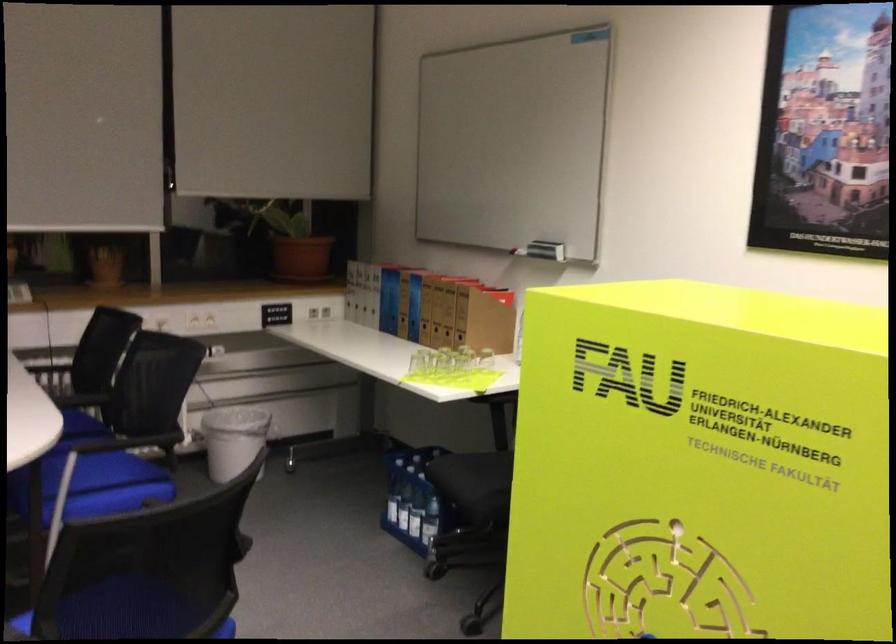
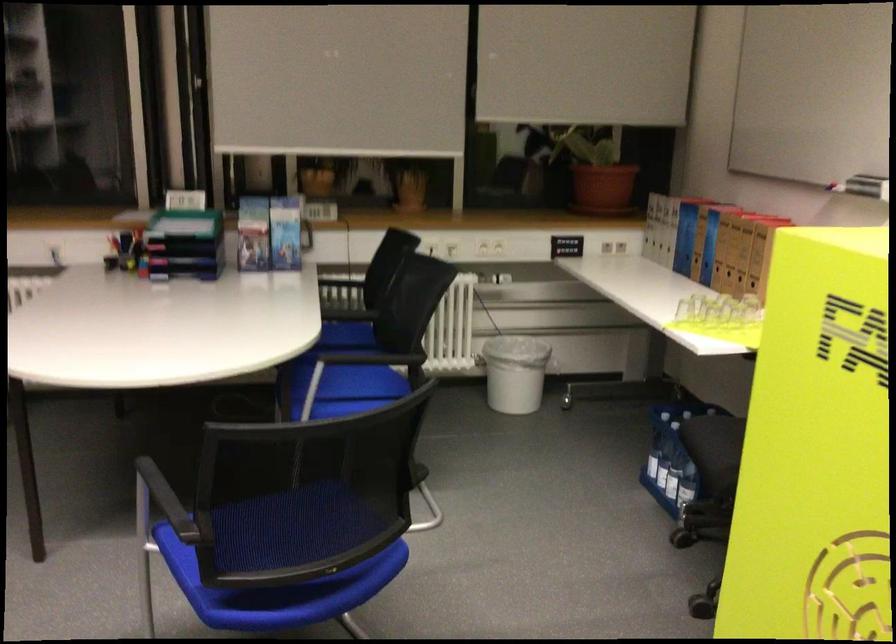
Find the pixel in the second image that matches the point at 242,444 in the first image.

(514, 373)